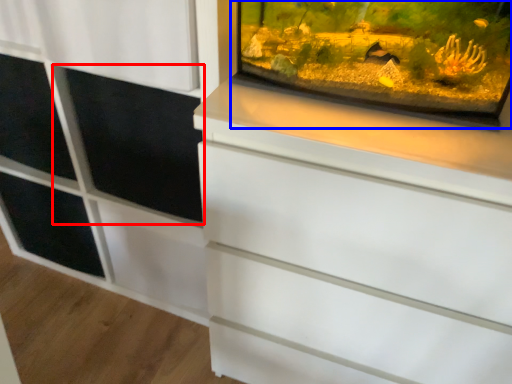
Question: Which point is further to the camera, screen door (highlighted by a red box) or glass box (highlighted by a blue box)?

Choices:
 (A) screen door
 (B) glass box

Answer: (A)